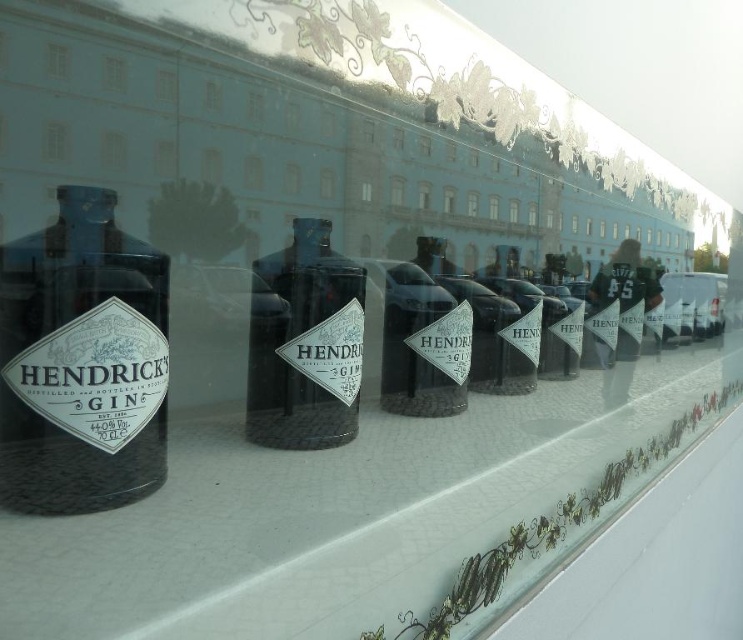
You are a store manager arranging items on a shelf. You have a matte black bottle at left and a white textured surface at center. Which object is wider?

The white textured surface at center is wider than the matte black bottle at left.

You are a bartender who needs to place a new bottle of Hendrick s Gin on the display. The display has a white textured surface at center and a matte black bottle at left. Where should you place the new bottle to maintain the arrangement?

The white textured surface at center is positioned under the matte black bottle at left, so you should place the new bottle of Hendrick s Gin on the white textured surface at center to maintain the arrangement.